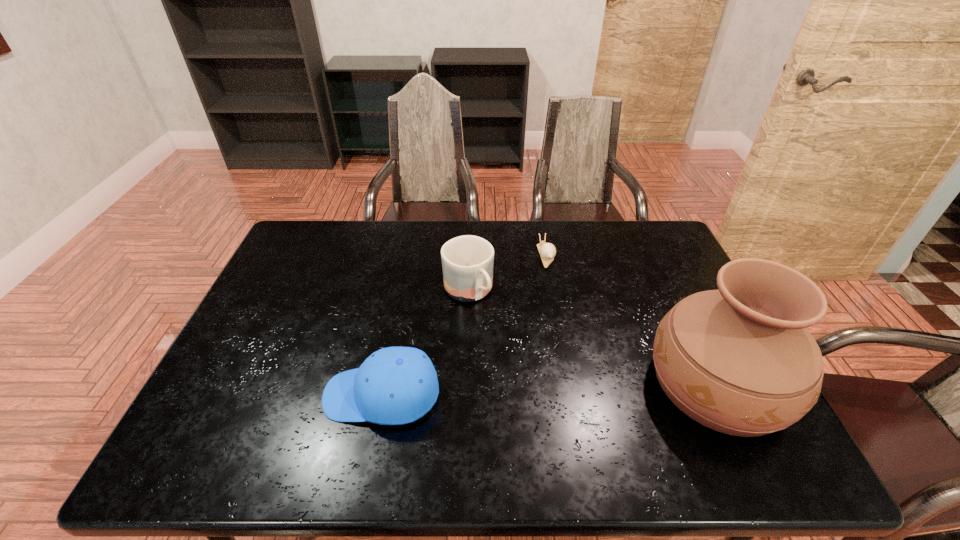
Find the location of a particular element. This screenshot has width=960, height=540. free spot between the shortest object and the second farthest object is located at coordinates (507, 273).

What are the coordinates of `free point between the shortest object and the third nearest object` in the screenshot? It's located at click(507, 273).

Where is `vacant space in between the mug and the rightmost object`? The height and width of the screenshot is (540, 960). vacant space in between the mug and the rightmost object is located at coordinates (593, 338).

Identify the location of unoccupied position between the tallest object and the second farthest object. (x=593, y=338).

Image resolution: width=960 pixels, height=540 pixels. Identify the location of empty location between the rightmost object and the mug. (593, 338).

At what (x,y) coordinates should I click in order to perform the action: click on vacant area that lies between the urn and the third object from left to right. Please return your answer as a coordinate pair (x, y). Looking at the image, I should click on (632, 320).

You are a GUI agent. You are given a task and a screenshot of the screen. Output one action in this format:
    pyautogui.click(x=<x>, y=<y>)
    Task: Click on the vacant region between the tallest object and the shortest object
    
    Given the screenshot: What is the action you would take?
    (632, 320)

You are a GUI agent. You are given a task and a screenshot of the screen. Output one action in this format:
    pyautogui.click(x=<x>, y=<y>)
    Task: Click on the vacant space in between the second object from right to left and the second farthest object
    Image resolution: width=960 pixels, height=540 pixels.
    Given the screenshot: What is the action you would take?
    pyautogui.click(x=507, y=273)

Locate an element on the screen. object that is the closest to the farthest object is located at coordinates (467, 261).

You are a GUI agent. You are given a task and a screenshot of the screen. Output one action in this format:
    pyautogui.click(x=<x>, y=<y>)
    Task: Click on the object that can be found as the second closest to the urn
    
    Given the screenshot: What is the action you would take?
    pyautogui.click(x=467, y=261)